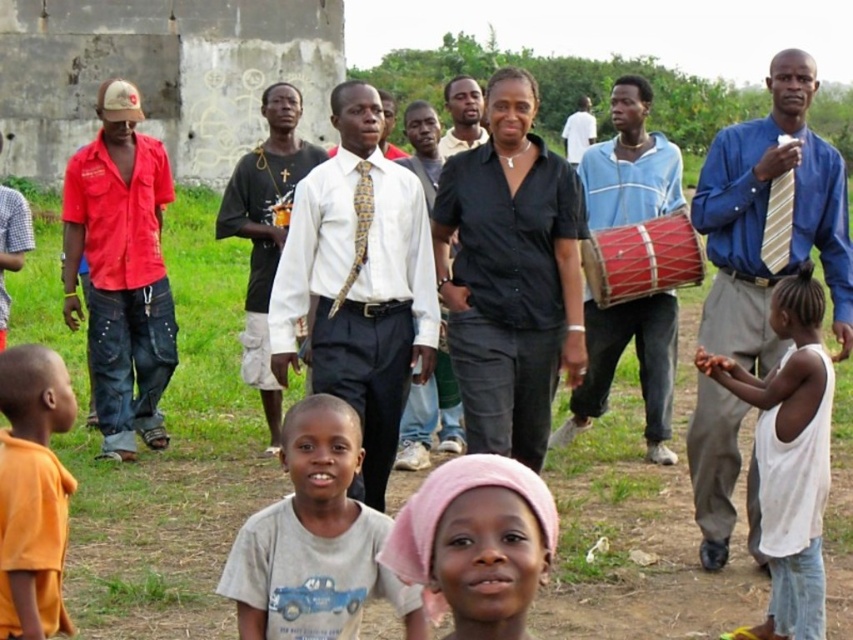
Question: Where is gray cotton shirt at lower center located in relation to striped fabric tie at right in the image?

Choices:
 (A) right
 (B) left

Answer: (B)

Question: Estimate the real-world distances between objects in this image. Which object is farther from the yellow patterned tie at center?

Choices:
 (A) dark blue shirt at center
 (B) orange matte shirt at lower left
 (C) white cotton tank top at lower right
 (D) black matte shirt at center

Answer: (C)

Question: Which point is farther to the camera?

Choices:
 (A) white shirt with tie at center
 (B) pink fabric headscarf at center

Answer: (A)

Question: Does gray cotton shirt at lower center have a lesser width compared to yellow patterned tie at center?

Choices:
 (A) no
 (B) yes

Answer: (A)

Question: Is the position of gray cotton shirt at lower center less distant than that of blue cotton shirt at center?

Choices:
 (A) no
 (B) yes

Answer: (B)

Question: Based on their relative distances, which object is farther from the white shirt at center?

Choices:
 (A) blue cotton shirt at center
 (B) dark blue shirt at center
 (C) orange matte shirt at lower left

Answer: (C)